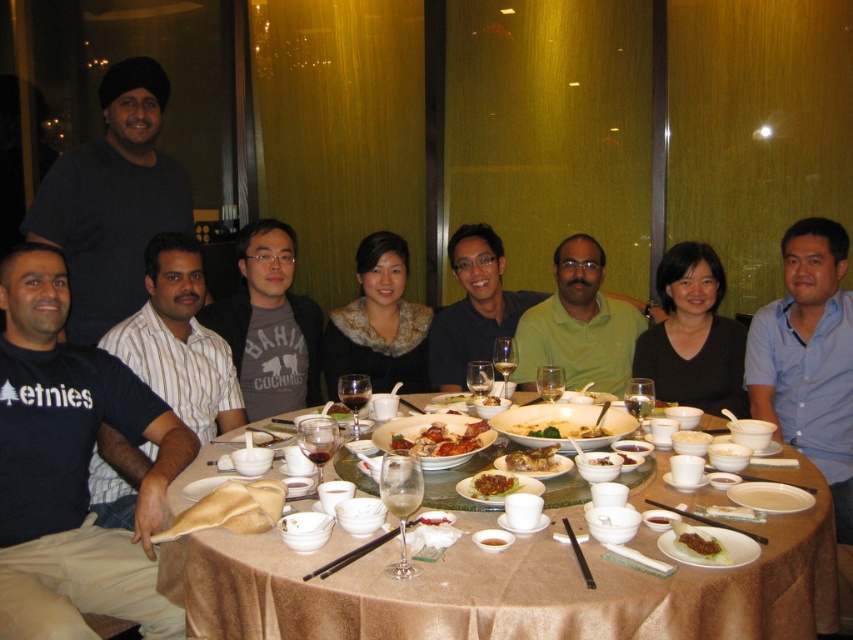
You are a waiter in a restaurant and need to determine if the brown glossy chicken at center can fit into the brown glossy bowl at center. Based on their sizes, can the chicken fit inside the bowl?

The brown glossy chicken at center is bigger than the brown glossy bowl at center, so the chicken cannot fit inside the bowl.

You are a guest at the table and want to reach for the brown crispy chicken at center and the white matte bowl at center. Which one is closer to your left hand if you are sitting at the table?

The brown crispy chicken at center is to the left of the white matte bowl at center, so it is closer to your left hand.

You are a food critic who wants to take a photo of the brown crispy chicken at center and the white matte bowl at center. Which object should you focus on first if you want to capture both in the same frame without moving the camera?

The brown crispy chicken at center is wider than the white matte bowl at center, so you should focus on the brown crispy chicken at center first to ensure it fits within the frame.